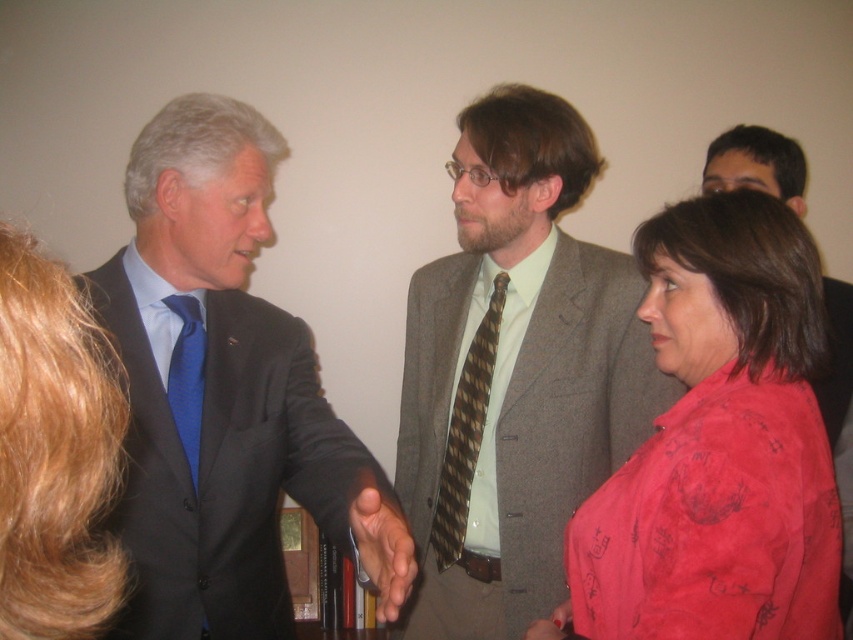
Question: Which of the following is the closest to the observer?

Choices:
 (A) (805, 541)
 (B) (474, 337)
 (C) (390, 515)

Answer: (C)

Question: Observing the image, what is the correct spatial positioning of smooth skin hand at center in reference to blue silk tie at left?

Choices:
 (A) left
 (B) right

Answer: (B)

Question: Which point is closer to the camera?

Choices:
 (A) matte gray suit at right
 (B) gray wool suit at center

Answer: (A)

Question: Can you confirm if matte black suit at center is smaller than blue silk tie at left?

Choices:
 (A) no
 (B) yes

Answer: (A)

Question: In this image, where is matte black suit at center located relative to matte red blouse at center?

Choices:
 (A) right
 (B) left

Answer: (B)

Question: Considering the real-world distances, which object is farthest from the matte gray suit at right?

Choices:
 (A) blue silk tie at left
 (B) gray wool suit at center
 (C) matte black suit at center
 (D) matte red blouse at center

Answer: (A)